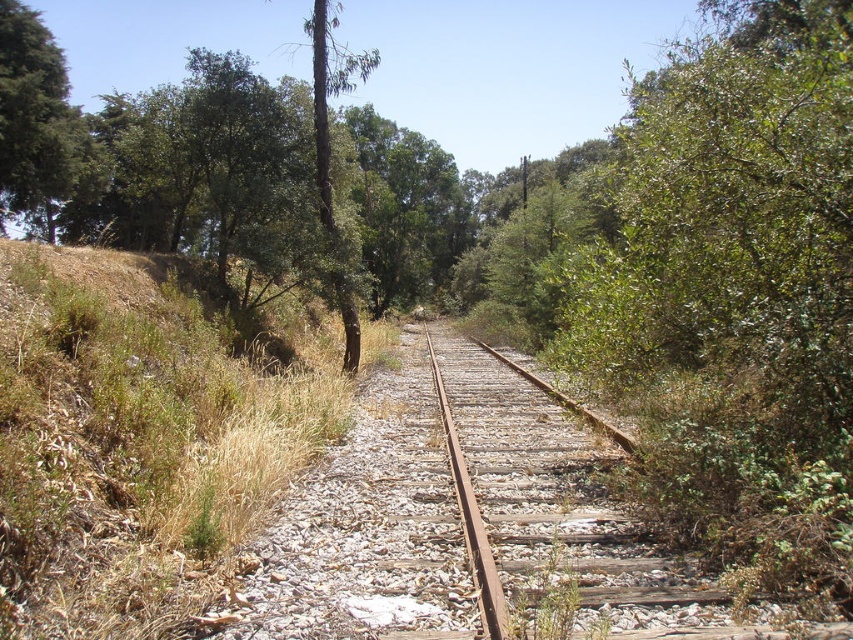
You are standing at the center of the railway tracks and looking towards the direction where the tracks disappear into the distance. Which direction should you look to see the dry grass at left?

The dry grass at left is located at the left side of the railway tracks, so you should look to your left to see it.

You are standing on the railway track and looking towards the left side. You see dry grass at left and green leafy tree at upper left. Which object is nearer to you?

The dry grass at left is closer to the viewer than the green leafy tree at upper left, so the dry grass at left is nearer to you.